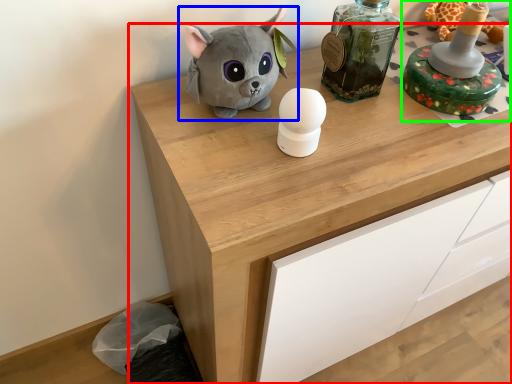
Question: Which object is positioned farthest from chest of drawers (highlighted by a red box)? Select from toy (highlighted by a blue box) and toy (highlighted by a green box).

Choices:
 (A) toy
 (B) toy

Answer: (B)